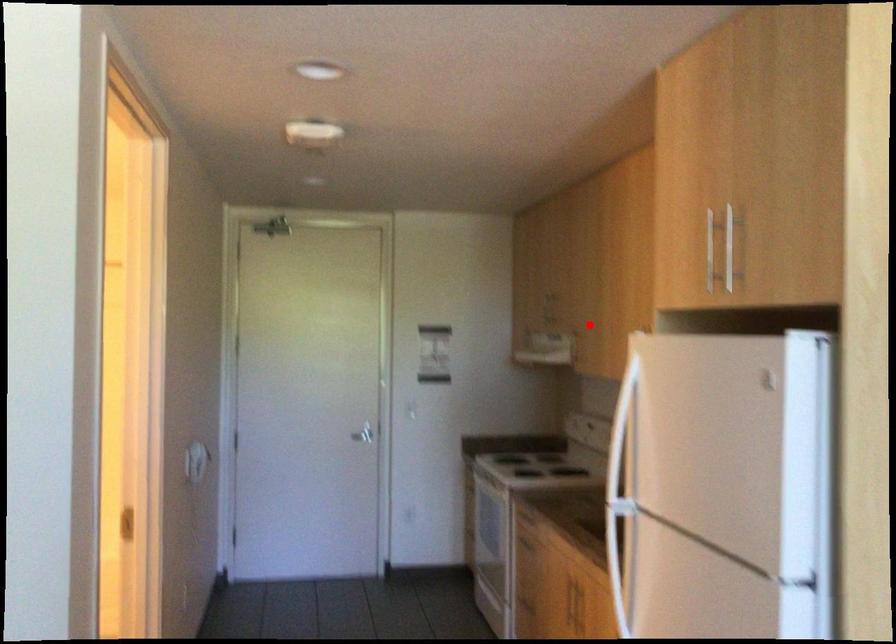
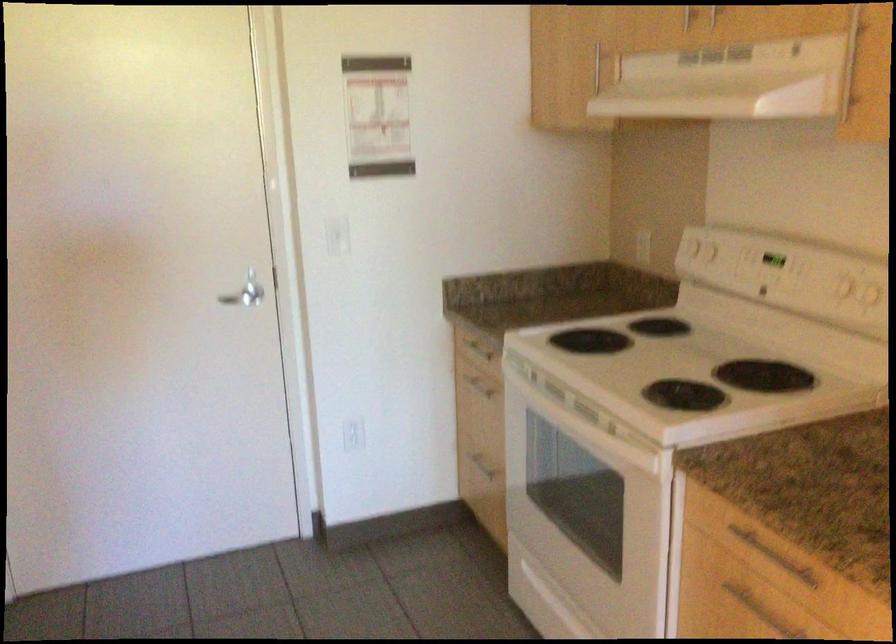
In the second image, find the point that corresponds to the highlighted location in the first image.

(868, 77)